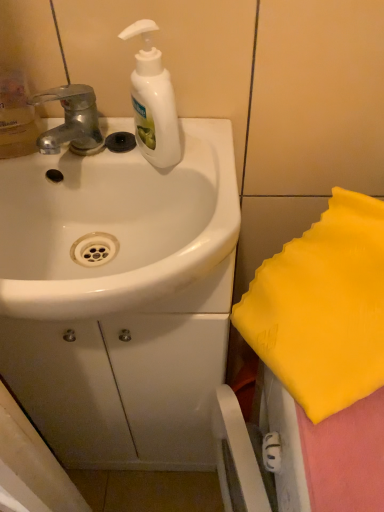
Question: Is white glossy sink at center aimed at white glossy soap dispenser at upper center?

Choices:
 (A) yes
 (B) no

Answer: (B)

Question: Considering the relative sizes of white glossy sink at center and white glossy soap dispenser at upper center in the image provided, is white glossy sink at center wider than white glossy soap dispenser at upper center?

Choices:
 (A) no
 (B) yes

Answer: (B)

Question: Is white glossy soap dispenser at upper center located within white glossy sink at center?

Choices:
 (A) no
 (B) yes

Answer: (A)

Question: Is white glossy sink at center looking in the opposite direction of white glossy soap dispenser at upper center?

Choices:
 (A) yes
 (B) no

Answer: (B)

Question: Is white glossy sink at center thinner than white glossy soap dispenser at upper center?

Choices:
 (A) yes
 (B) no

Answer: (B)

Question: From the image's perspective, is white glossy sink at center over white glossy soap dispenser at upper center?

Choices:
 (A) yes
 (B) no

Answer: (B)

Question: Considering the relative positions of white glossy soap dispenser at upper center and silver metallic faucet at upper left in the image provided, is white glossy soap dispenser at upper center behind silver metallic faucet at upper left?

Choices:
 (A) yes
 (B) no

Answer: (B)

Question: Is white glossy soap dispenser at upper center far from silver metallic faucet at upper left?

Choices:
 (A) no
 (B) yes

Answer: (A)

Question: Are white glossy soap dispenser at upper center and silver metallic faucet at upper left making contact?

Choices:
 (A) yes
 (B) no

Answer: (A)

Question: Considering the relative sizes of white glossy soap dispenser at upper center and silver metallic faucet at upper left in the image provided, is white glossy soap dispenser at upper center taller than silver metallic faucet at upper left?

Choices:
 (A) yes
 (B) no

Answer: (A)

Question: From a real-world perspective, is white glossy soap dispenser at upper center positioned under silver metallic faucet at upper left based on gravity?

Choices:
 (A) yes
 (B) no

Answer: (B)

Question: From the image's perspective, is white glossy soap dispenser at upper center beneath silver metallic faucet at upper left?

Choices:
 (A) yes
 (B) no

Answer: (B)

Question: Is silver metallic faucet at upper left closer to camera compared to white glossy sink at center?

Choices:
 (A) no
 (B) yes

Answer: (A)